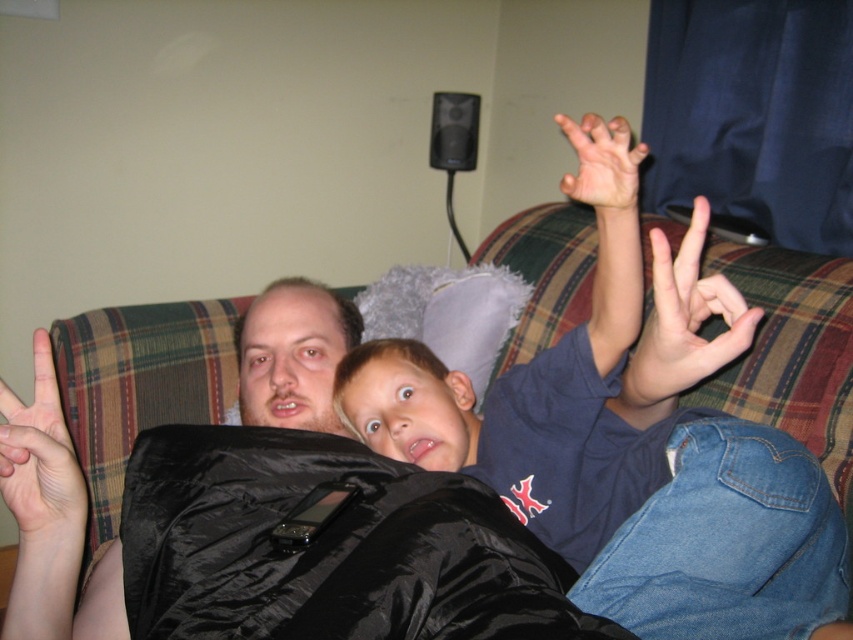
Between black silky sleeping bag at center and white matte hand at upper right, which one has more height?

Standing taller between the two is white matte hand at upper right.

Does point (549, 608) come in front of point (654, 378)?

Yes, point (549, 608) is in front of point (654, 378).

Between point (387, 589) and point (751, 317), which one is positioned in front?

Point (387, 589)

Where is `black silky sleeping bag at center`? black silky sleeping bag at center is located at coordinates (328, 547).

Does pale skin flesh at left lie in front of smooth skin hand at upper right?

No, pale skin flesh at left is behind smooth skin hand at upper right.

This screenshot has height=640, width=853. Describe the element at coordinates (39, 456) in the screenshot. I see `pale skin flesh at left` at that location.

Is point (3, 440) less distant than point (561, 180)?

Yes, point (3, 440) is in front of point (561, 180).

You are a GUI agent. You are given a task and a screenshot of the screen. Output one action in this format:
    pyautogui.click(x=<x>, y=<y>)
    Task: Click on the pale skin flesh at left
    
    Given the screenshot: What is the action you would take?
    pyautogui.click(x=39, y=456)

Which of these two, smooth skin face at center or white matte hand at upper right, stands taller?

Standing taller between the two is smooth skin face at center.

Is point (343, 323) less distant than point (695, 198)?

No, it is not.

Identify the location of smooth skin face at center. The image size is (853, 640). (293, 355).